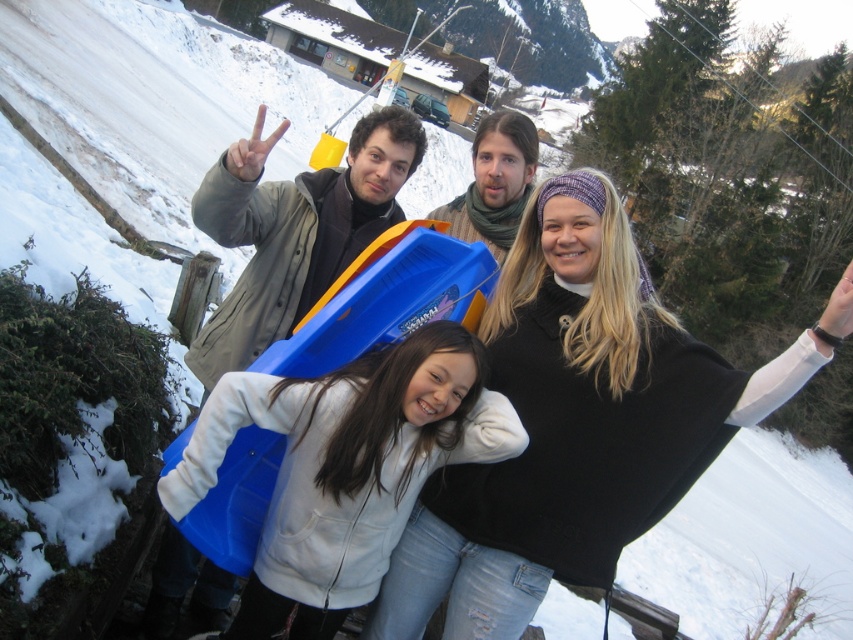
Between blue plastic sled at center and matte gray jacket at upper left, which one appears on the left side from the viewer's perspective?

matte gray jacket at upper left is more to the left.

Between point (450, 477) and point (160, 564), which one is positioned behind?

Positioned behind is point (160, 564).

Which is behind, point (486, 468) or point (221, 588)?

The point (221, 588) is behind.

Identify the location of blue plastic sled at center. This screenshot has height=640, width=853. (578, 422).